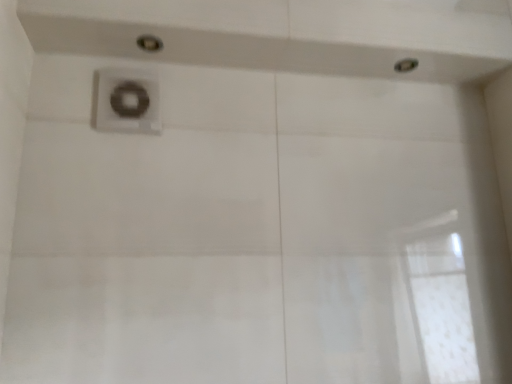
Question: From a real-world perspective, is satin nickel faucet at upper center beneath metallic silver showerhead at upper right, which is the 2th shower from front to back?

Choices:
 (A) no
 (B) yes

Answer: (B)

Question: From the image's perspective, is satin nickel faucet at upper center beneath metallic silver showerhead at upper right, the first shower in the back-to-front sequence?

Choices:
 (A) no
 (B) yes

Answer: (B)

Question: Can you confirm if satin nickel faucet at upper center is thinner than metallic silver showerhead at upper right, arranged as the second shower when viewed from the left?

Choices:
 (A) yes
 (B) no

Answer: (A)

Question: Considering the relative sizes of satin nickel faucet at upper center and metallic silver showerhead at upper right, arranged as the second shower when viewed from the left, in the image provided, is satin nickel faucet at upper center smaller than metallic silver showerhead at upper right, arranged as the second shower when viewed from the left,?

Choices:
 (A) no
 (B) yes

Answer: (A)

Question: Does satin nickel faucet at upper center appear on the left side of metallic silver showerhead at upper right, the first shower in the back-to-front sequence?

Choices:
 (A) yes
 (B) no

Answer: (A)

Question: Which is correct: satin nickel faucet at upper center is inside matte silver shower at upper center, placed as the 1th shower when sorted from front to back, or outside of it?

Choices:
 (A) outside
 (B) inside

Answer: (A)

Question: Based on their positions, is satin nickel faucet at upper center located to the left or right of matte silver shower at upper center, the first shower from the left?

Choices:
 (A) left
 (B) right

Answer: (A)

Question: From a real-world perspective, is satin nickel faucet at upper center positioned above or below matte silver shower at upper center, which ranks as the second shower in right-to-left order?

Choices:
 (A) above
 (B) below

Answer: (B)

Question: Considering their positions, is satin nickel faucet at upper center located in front of or behind matte silver shower at upper center, positioned as the 2th shower in back-to-front order?

Choices:
 (A) behind
 (B) front

Answer: (A)

Question: In the image, is matte silver shower at upper center, which ranks as the second shower in right-to-left order, on the left side or the right side of metallic silver showerhead at upper right, which is the 2th shower from front to back?

Choices:
 (A) right
 (B) left

Answer: (B)

Question: Choose the correct answer: Is matte silver shower at upper center, which ranks as the second shower in right-to-left order, inside metallic silver showerhead at upper right, which is the 2th shower from front to back, or outside it?

Choices:
 (A) inside
 (B) outside

Answer: (B)

Question: Considering the positions of matte silver shower at upper center, which ranks as the second shower in right-to-left order, and metallic silver showerhead at upper right, arranged as the second shower when viewed from the left, in the image, is matte silver shower at upper center, which ranks as the second shower in right-to-left order, bigger or smaller than metallic silver showerhead at upper right, arranged as the second shower when viewed from the left,?

Choices:
 (A) small
 (B) big

Answer: (B)

Question: Considering the positions of point (151, 44) and point (412, 57), is point (151, 44) closer or farther from the camera than point (412, 57)?

Choices:
 (A) closer
 (B) farther

Answer: (A)

Question: Considering the positions of satin nickel faucet at upper center and metallic silver showerhead at upper right, arranged as the second shower when viewed from the left, in the image, is satin nickel faucet at upper center taller or shorter than metallic silver showerhead at upper right, arranged as the second shower when viewed from the left,?

Choices:
 (A) tall
 (B) short

Answer: (A)

Question: Based on their positions, is satin nickel faucet at upper center located to the left or right of metallic silver showerhead at upper right, which is the 1th shower in right-to-left order?

Choices:
 (A) left
 (B) right

Answer: (A)